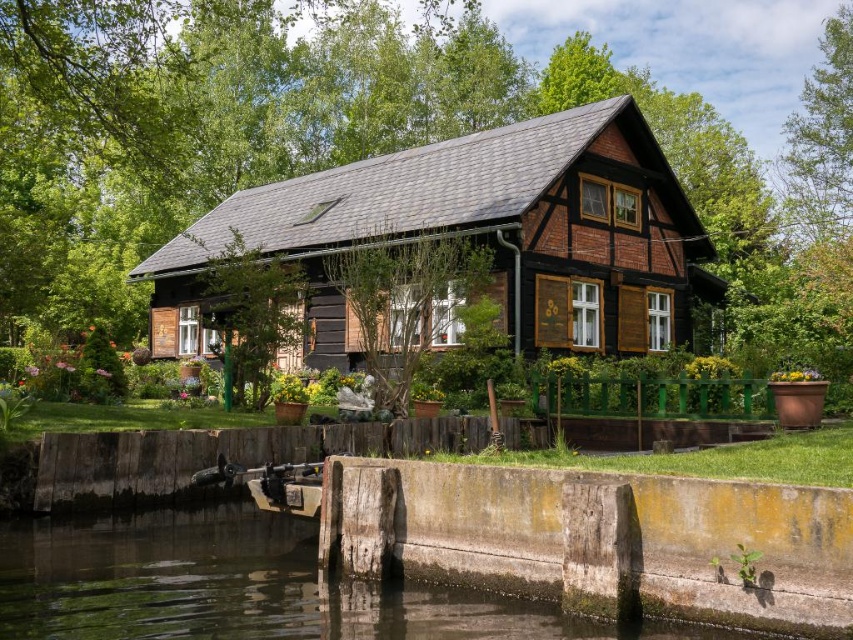
You are standing at the entrance of the house and want to find the black wooden cabin at center. According to the map, where would you look relative to your current position?

The black wooden cabin at center is located at coordinates 0.367 on the x axis and 0.560 on the y axis relative to your current position.

You are standing at the center of the image and want to locate the black wooden cabin at center. According to the coordinates, where would you find it?

The black wooden cabin at center is located at the coordinates point (477, 234).